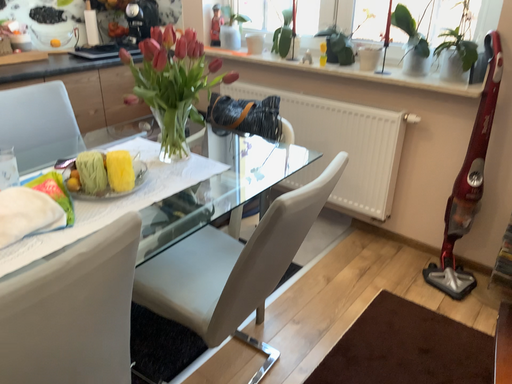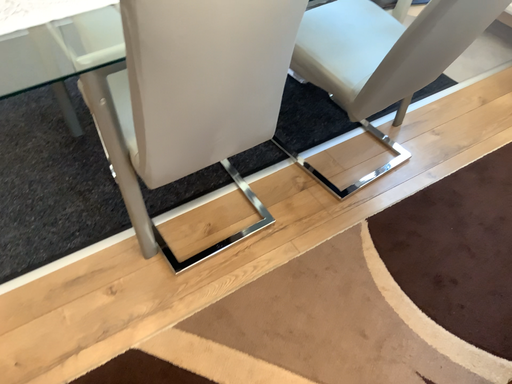
Question: Which way did the camera rotate in the video?

Choices:
 (A) rotated downward
 (B) rotated upward

Answer: (A)